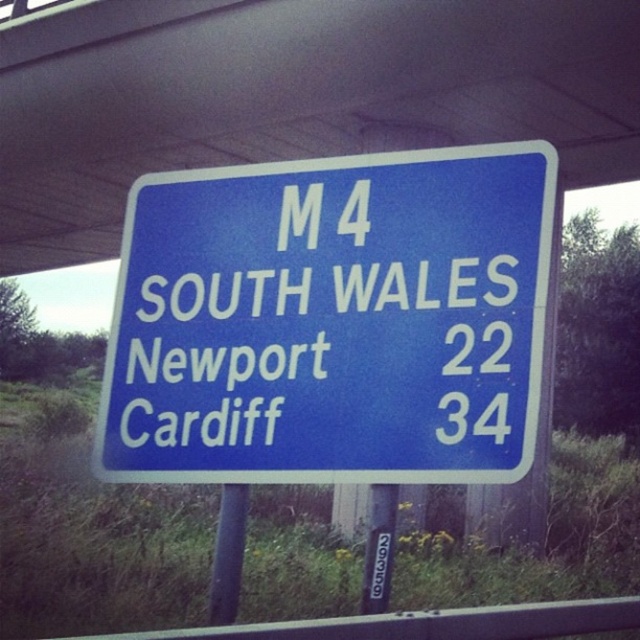
Question: Where is blue glossy sign at center located in relation to black metal pole at center in the image?

Choices:
 (A) below
 (B) above

Answer: (B)

Question: Is blue plastic sign at upper center positioned at the back of black metal pole at center?

Choices:
 (A) no
 (B) yes

Answer: (B)

Question: Among these points, which one is farthest from the camera?

Choices:
 (A) (42, 154)
 (B) (458, 300)
 (C) (227, 536)

Answer: (A)

Question: Which of these objects is positioned farthest from the blue plastic sign at upper center?

Choices:
 (A) black metal pole at center
 (B) blue glossy sign at center

Answer: (A)

Question: Which object is the farthest from the black metal pole at center?

Choices:
 (A) blue glossy sign at center
 (B) blue plastic sign at upper center

Answer: (B)

Question: Is blue plastic sign at upper center below black metal pole at center?

Choices:
 (A) no
 (B) yes

Answer: (A)